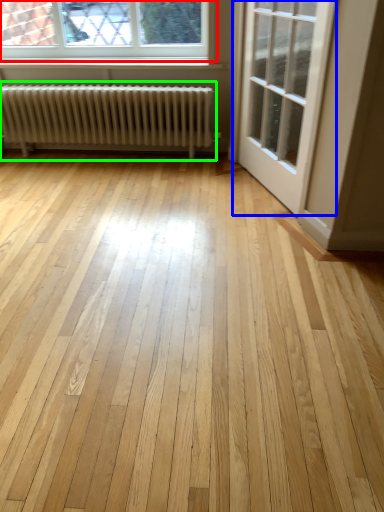
Question: Considering the real-world distances, which object is farthest from window (highlighted by a red box)? door (highlighted by a blue box) or radiator (highlighted by a green box)?

Choices:
 (A) door
 (B) radiator

Answer: (A)